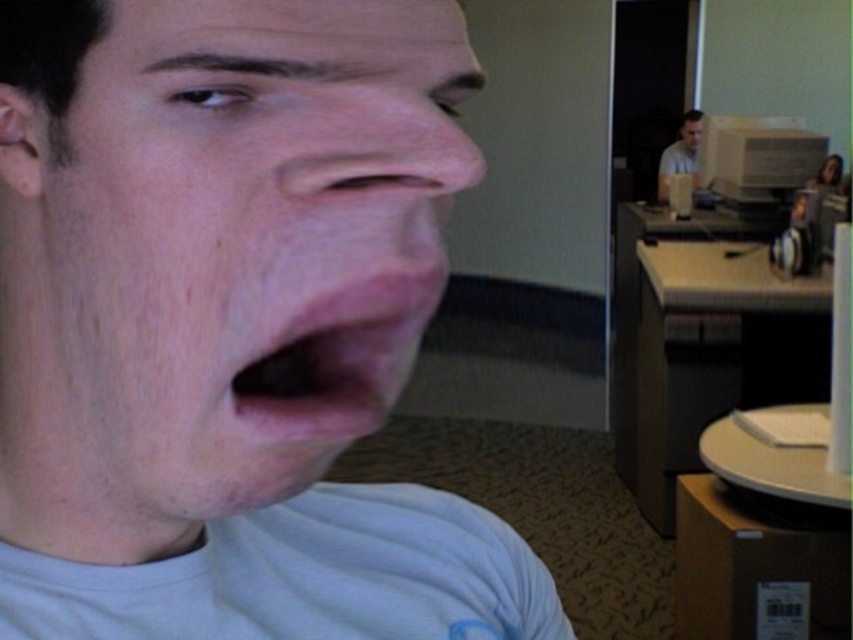
Who is taller, smooth skin face at center or matte white face at upper center?

With more height is matte white face at upper center.

This screenshot has height=640, width=853. What are the coordinates of `smooth skin face at center` in the screenshot? It's located at click(x=238, y=244).

Where is `smooth skin face at center`? This screenshot has width=853, height=640. smooth skin face at center is located at coordinates (238, 244).

Between point (280, 403) and point (698, 176), which one is positioned behind?

Point (698, 176)

Between smooth skin face at center and matte gray monitor at upper right, which one appears on the right side from the viewer's perspective?

matte gray monitor at upper right

Does point (344, 164) come farther from viewer compared to point (769, 182)?

No, (344, 164) is in front of (769, 182).

What are the coordinates of `smooth skin face at center` in the screenshot? It's located at (238, 244).

Does light blue shirt at upper right have a greater height compared to matte white face at upper center?

Correct, light blue shirt at upper right is much taller as matte white face at upper center.

Does light blue shirt at upper right have a lesser width compared to matte white face at upper center?

No.

Is point (664, 172) behind point (685, 122)?

No, it is in front of (685, 122).

This screenshot has height=640, width=853. I want to click on light blue shirt at upper right, so click(x=680, y=154).